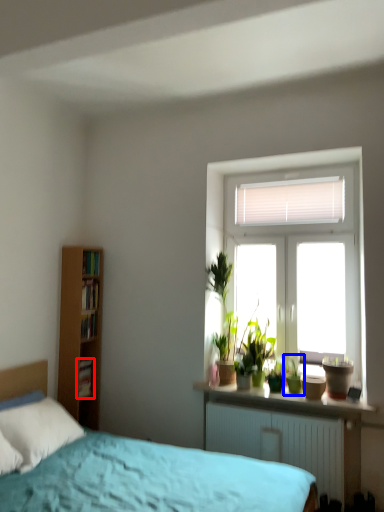
Question: Which object appears farthest to the camera in this image, book (highlighted by a red box) or houseplant (highlighted by a blue box)?

Choices:
 (A) book
 (B) houseplant

Answer: (A)